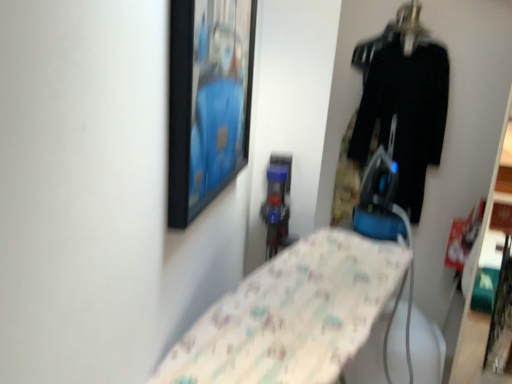
Question: Is black fabric pants at right wider or thinner than black matte picture frame at upper center?

Choices:
 (A) thin
 (B) wide

Answer: (B)

Question: In the image, is black fabric pants at right positioned in front of or behind black matte picture frame at upper center?

Choices:
 (A) behind
 (B) front

Answer: (A)

Question: Which object is positioned closest to the black fabric pants at right?

Choices:
 (A) metallic hanger at upper right
 (B) black matte picture frame at upper center

Answer: (A)

Question: Which object is positioned closest to the black matte picture frame at upper center?

Choices:
 (A) black fabric pants at right
 (B) metallic hanger at upper right

Answer: (A)